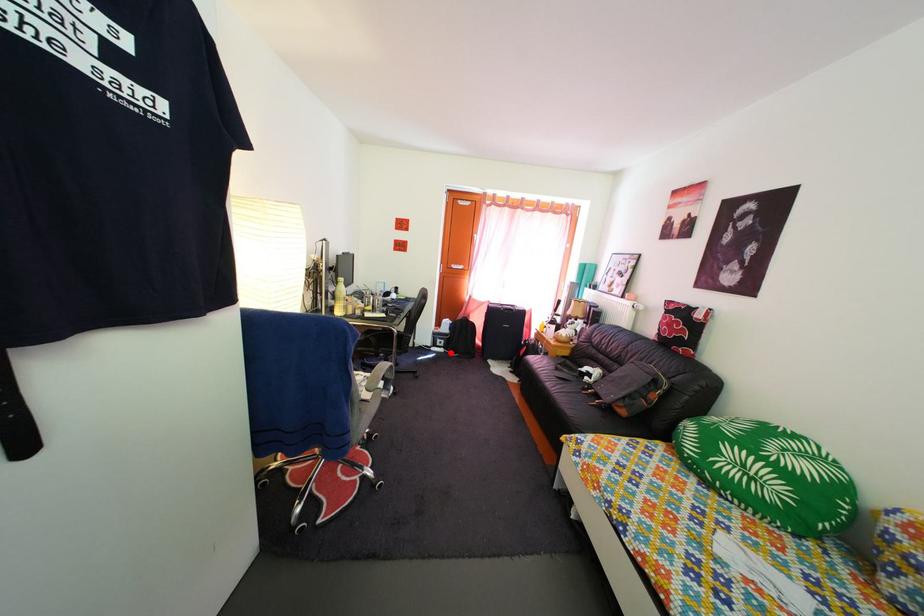
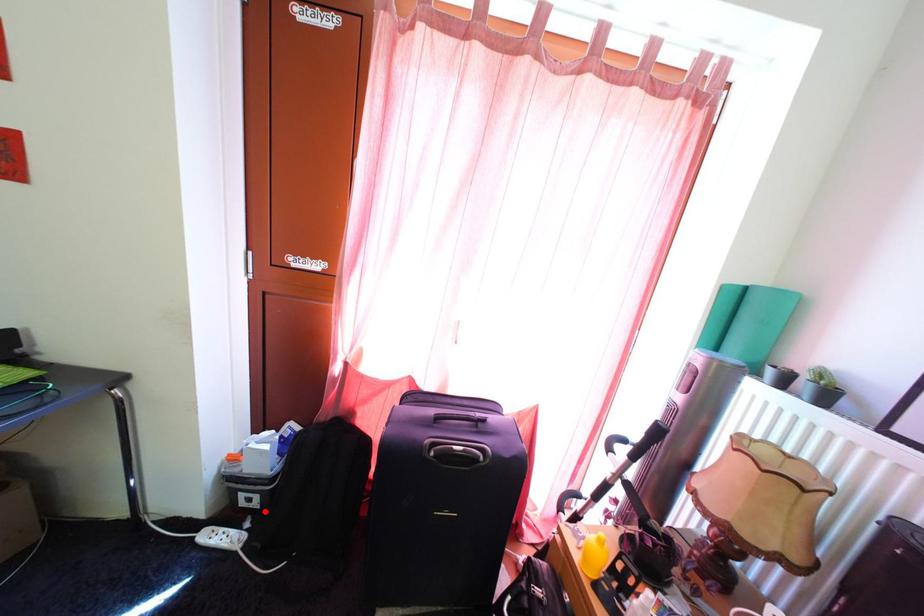
I am providing you with two images of the same scene from different viewpoints. A red point is marked on the first image and another point is marked on the second image. Are the points marked in image1 and image2 representing the same 3D position?

Yes